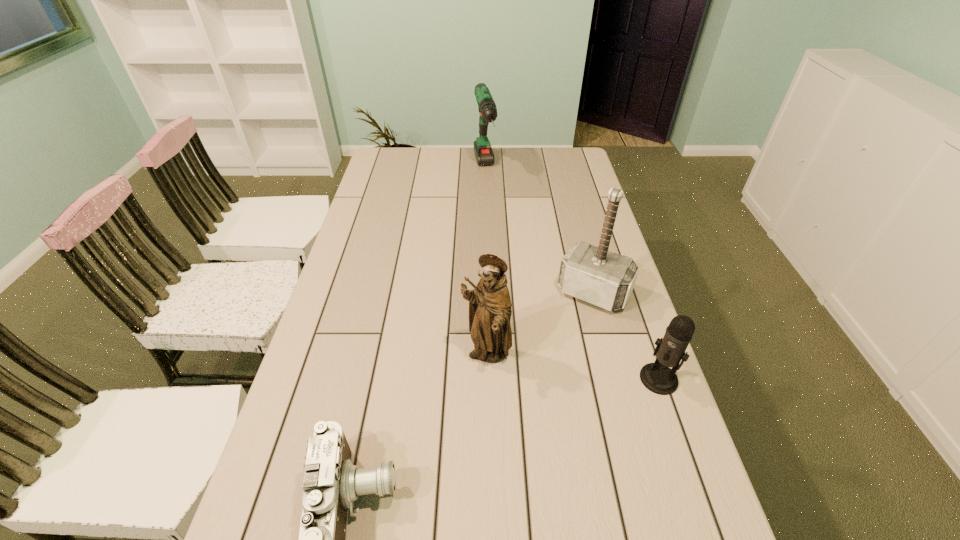
Point out which object is positioned as the fourth nearest to the microphone. Please provide its 2D coordinates. Your answer should be formatted as a tuple, i.e. [(x, y)], where the tuple contains the x and y coordinates of a point satisfying the conditions above.

[(483, 151)]